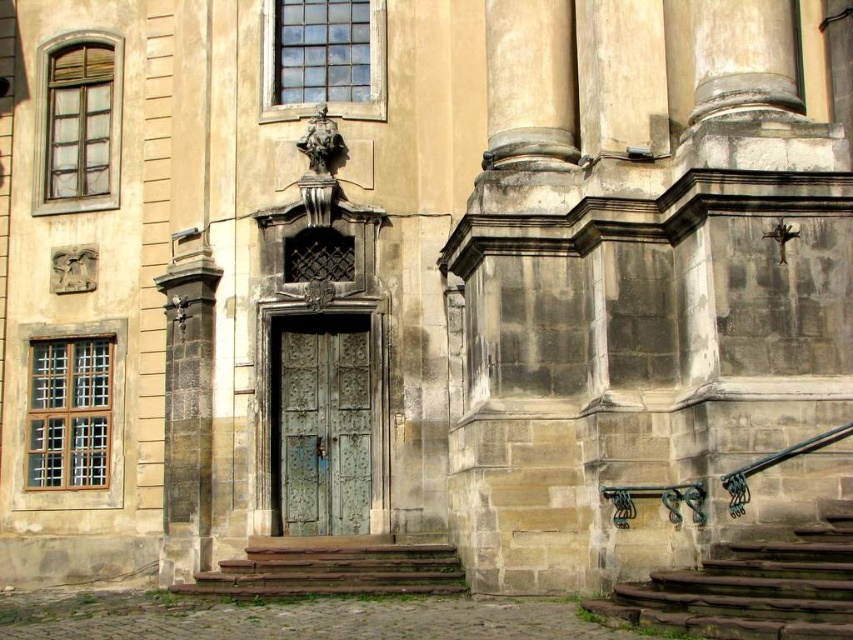
Can you confirm if green patina metal door at center is wider than brown stone stairs at lower center?

In fact, green patina metal door at center might be narrower than brown stone stairs at lower center.

Is green patina metal door at center positioned before brown stone stairs at lower center?

No, green patina metal door at center is further to the viewer.

This screenshot has width=853, height=640. Describe the element at coordinates (323, 426) in the screenshot. I see `green patina metal door at center` at that location.

Where is `green patina metal door at center`? This screenshot has width=853, height=640. green patina metal door at center is located at coordinates (323, 426).

Does green stone stairs at lower right appear on the right side of green patina metal door at center?

Indeed, green stone stairs at lower right is positioned on the right side of green patina metal door at center.

Is green stone stairs at lower right above green patina metal door at center?

Incorrect, green stone stairs at lower right is not positioned above green patina metal door at center.

I want to click on green stone stairs at lower right, so click(752, 586).

Is green stone stairs at lower right wider than brown stone stairs at lower center?

No.

Does green stone stairs at lower right have a lesser width compared to brown stone stairs at lower center?

Yes, green stone stairs at lower right is thinner than brown stone stairs at lower center.

Identify the location of green stone stairs at lower right. (752, 586).